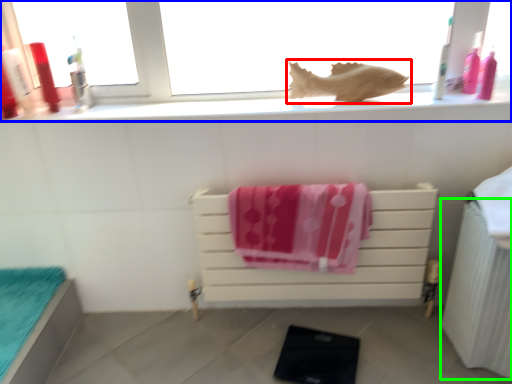
Question: Which object is the farthest from animal (highlighted by a red box)? Choose among these: window (highlighted by a blue box) or radiator (highlighted by a green box).

Choices:
 (A) window
 (B) radiator

Answer: (B)